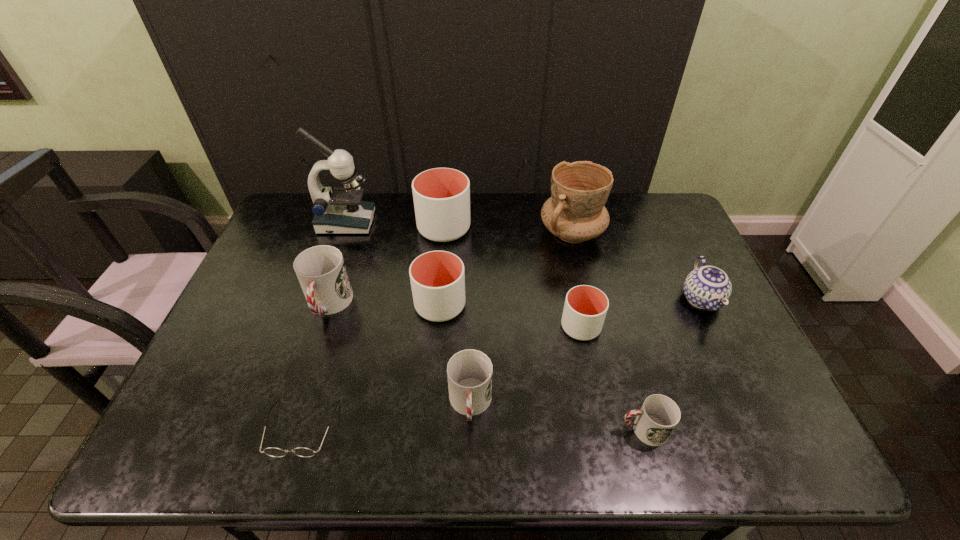
The image size is (960, 540). Find the location of `unoccupied area between the second smallest red cup and the rightmost object`. unoccupied area between the second smallest red cup and the rightmost object is located at coordinates (586, 352).

Image resolution: width=960 pixels, height=540 pixels. In order to click on free space between the smallest white cup and the chinaware in this screenshot , I will do click(641, 313).

This screenshot has width=960, height=540. I want to click on vacant point located between the second smallest white cup and the rightmost white cup, so click(511, 316).

What are the coordinates of `vacant area between the smallest red cup and the second tallest object` in the screenshot? It's located at (608, 332).

Identify the location of vacant space that is in between the second smallest red cup and the smallest white cup. This screenshot has height=540, width=960. (525, 366).

Identify the location of free point between the blue chinaware and the spectacles. This screenshot has height=540, width=960. (501, 364).

Find the location of a particular element. empty space that is in between the smallest red cup and the shortest object is located at coordinates 472,429.

The width and height of the screenshot is (960, 540). Identify the location of free space between the blue chinaware and the beige pottery. (636, 266).

Image resolution: width=960 pixels, height=540 pixels. I want to click on object that stands as the seventh closest to the rightmost object, so click(x=271, y=451).

Choose which object is the second nearest neighbor to the tallest cup. Please provide its 2D coordinates. Your answer should be formatted as a tuple, i.e. [(x, y)], where the tuple contains the x and y coordinates of a point satisfying the conditions above.

[(437, 278)]